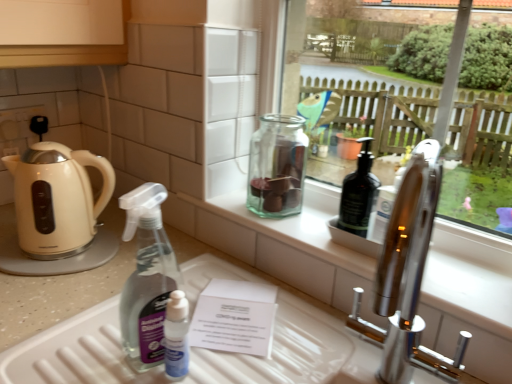
Question: Does white plastic tray at lower center appear on the left side of green glass jar at center?

Choices:
 (A) yes
 (B) no

Answer: (A)

Question: From the image's perspective, is white plastic tray at lower center located beneath green glass jar at center?

Choices:
 (A) no
 (B) yes

Answer: (B)

Question: Does white plastic tray at lower center come in front of green glass jar at center?

Choices:
 (A) no
 (B) yes

Answer: (B)

Question: Is white plastic tray at lower center facing away from green glass jar at center?

Choices:
 (A) yes
 (B) no

Answer: (B)

Question: Does white plastic tray at lower center lie behind green glass jar at center?

Choices:
 (A) yes
 (B) no

Answer: (B)

Question: In terms of width, does beige glossy kettle at left look wider or thinner when compared to green glass jar at center?

Choices:
 (A) thin
 (B) wide

Answer: (B)

Question: Is beige glossy kettle at left taller or shorter than green glass jar at center?

Choices:
 (A) short
 (B) tall

Answer: (B)

Question: Based on their positions, is beige glossy kettle at left located to the left or right of green glass jar at center?

Choices:
 (A) right
 (B) left

Answer: (B)

Question: Choose the correct answer: Is beige glossy kettle at left inside green glass jar at center or outside it?

Choices:
 (A) outside
 (B) inside

Answer: (A)

Question: Visually, is green glass jar at center positioned to the left or to the right of beige glossy kettle at left?

Choices:
 (A) left
 (B) right

Answer: (B)

Question: Looking at the image, does green glass jar at center seem bigger or smaller compared to beige glossy kettle at left?

Choices:
 (A) big
 (B) small

Answer: (B)

Question: From a real-world perspective, is green glass jar at center above or below beige glossy kettle at left?

Choices:
 (A) below
 (B) above

Answer: (B)

Question: Choose the correct answer: Is green glass jar at center inside beige glossy kettle at left or outside it?

Choices:
 (A) inside
 (B) outside

Answer: (B)

Question: Is point (52, 178) closer or farther from the camera than point (120, 375)?

Choices:
 (A) closer
 (B) farther

Answer: (B)

Question: In the image, is beige glossy kettle at left positioned in front of or behind white plastic tray at lower center?

Choices:
 (A) behind
 (B) front

Answer: (A)